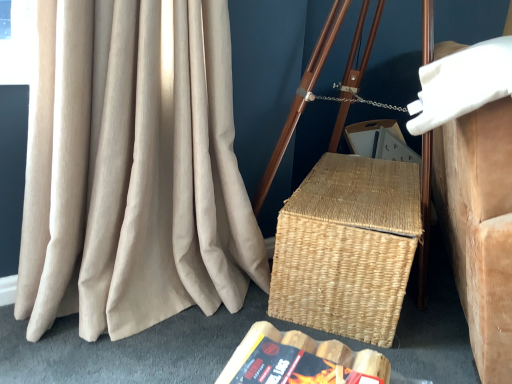
Question: From the image's perspective, does beige corduroy curtain at left appear higher than white foam pillow at upper right?

Choices:
 (A) yes
 (B) no

Answer: (B)

Question: Is beige corduroy curtain at left closer to the viewer compared to white foam pillow at upper right?

Choices:
 (A) no
 (B) yes

Answer: (A)

Question: Is beige corduroy curtain at left looking in the opposite direction of white foam pillow at upper right?

Choices:
 (A) yes
 (B) no

Answer: (B)

Question: Is beige corduroy curtain at left at the right side of white foam pillow at upper right?

Choices:
 (A) yes
 (B) no

Answer: (B)

Question: Does beige corduroy curtain at left have a smaller size compared to white foam pillow at upper right?

Choices:
 (A) no
 (B) yes

Answer: (B)

Question: Which is correct: hardcover book at lower center is inside beige corduroy curtain at left, or outside of it?

Choices:
 (A) inside
 (B) outside

Answer: (B)

Question: From a real-world perspective, is hardcover book at lower center physically located above or below beige corduroy curtain at left?

Choices:
 (A) above
 (B) below

Answer: (B)

Question: Considering the relative positions of hardcover book at lower center and beige corduroy curtain at left in the image provided, is hardcover book at lower center to the left or to the right of beige corduroy curtain at left?

Choices:
 (A) right
 (B) left

Answer: (A)

Question: Looking at their shapes, would you say hardcover book at lower center is wider or thinner than beige corduroy curtain at left?

Choices:
 (A) wide
 (B) thin

Answer: (B)

Question: Is point (403, 213) positioned closer to the camera than point (458, 157)?

Choices:
 (A) farther
 (B) closer

Answer: (A)

Question: Based on their sizes in the image, would you say natural woven picnic basket at center is bigger or smaller than white foam pillow at upper right?

Choices:
 (A) small
 (B) big

Answer: (A)

Question: From their relative heights in the image, would you say natural woven picnic basket at center is taller or shorter than white foam pillow at upper right?

Choices:
 (A) tall
 (B) short

Answer: (B)

Question: In the image, is natural woven picnic basket at center positioned in front of or behind white foam pillow at upper right?

Choices:
 (A) front
 (B) behind

Answer: (B)

Question: From the image's perspective, is beige corduroy curtain at left located above or below natural woven picnic basket at center?

Choices:
 (A) below
 (B) above

Answer: (B)

Question: In terms of height, does beige corduroy curtain at left look taller or shorter compared to natural woven picnic basket at center?

Choices:
 (A) short
 (B) tall

Answer: (B)